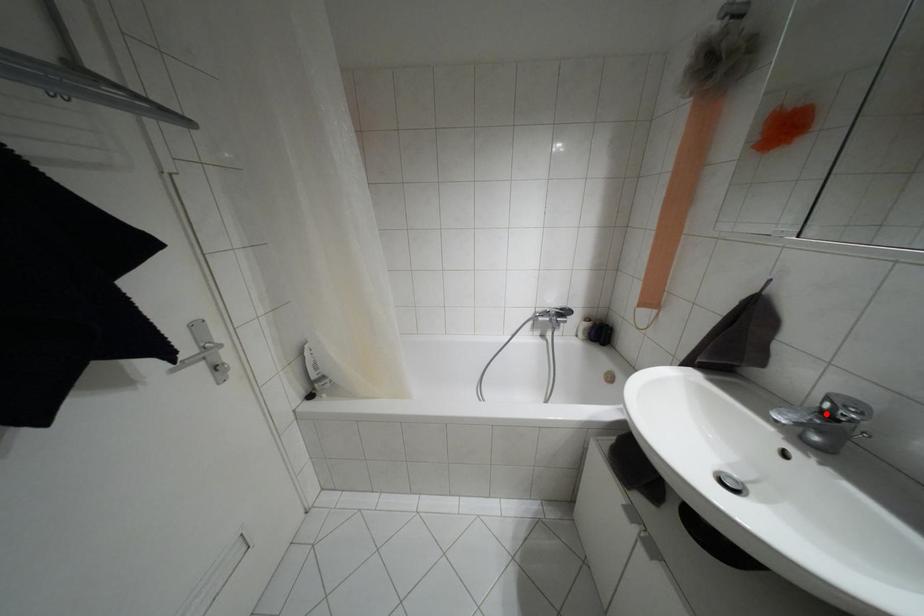
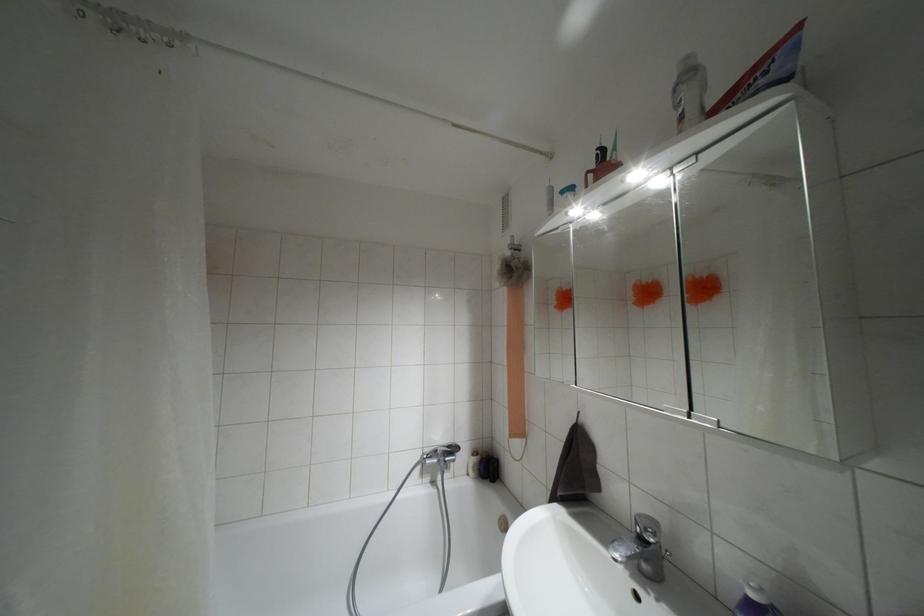
In the second image, find the point that corresponds to the highlighted location in the first image.

(641, 538)